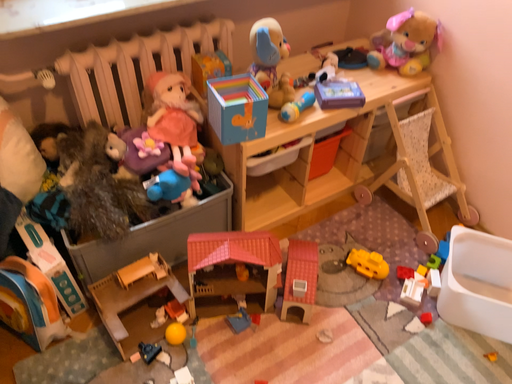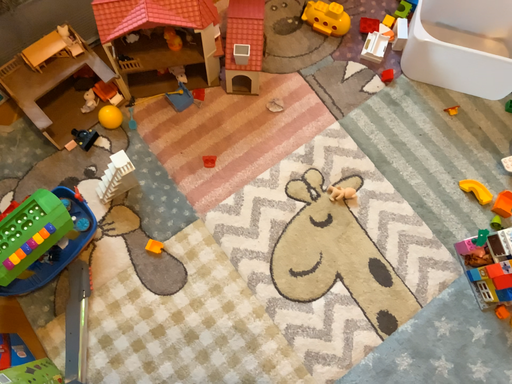
Question: Which way did the camera rotate in the video?

Choices:
 (A) rotated upward
 (B) rotated downward

Answer: (B)